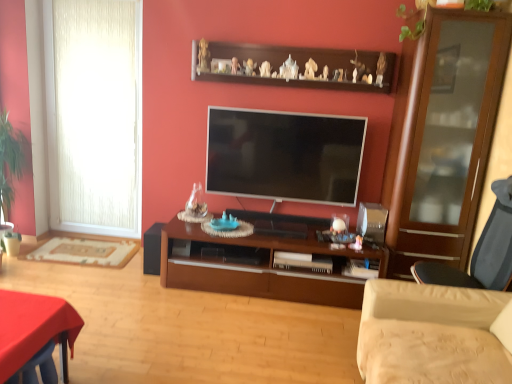
Identify the location of free space to the left of brown wood cabinet at center. (128, 298).